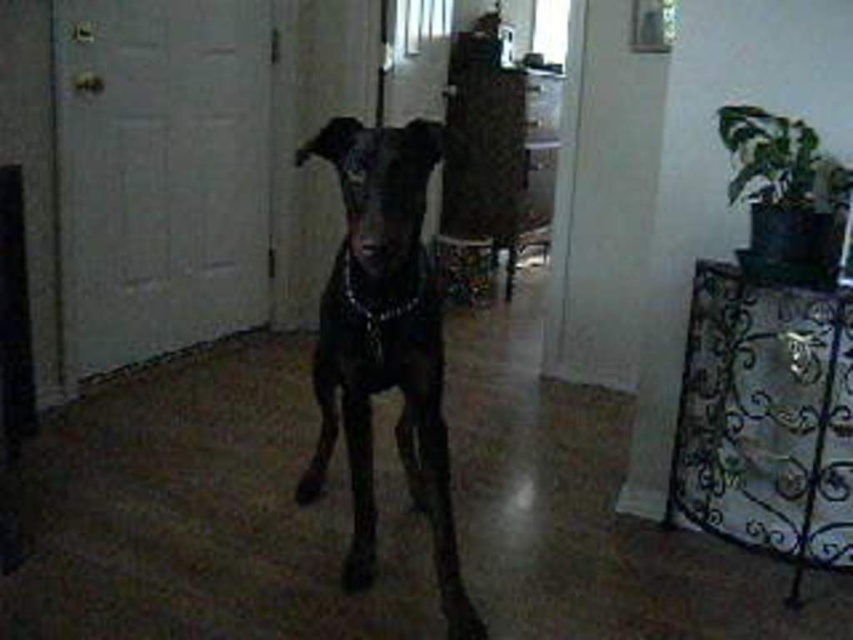
You are a dog trainer holding a leash that is 20 centimeters long. You want to attach the leash to the black chain at center so that the shiny black dog at center can move freely without pulling the leash tight. Is this possible?

The shiny black dog at center and the black chain at center are 20.34 centimeters apart from each other. Since the leash is only 20 centimeters long, the dog cannot move freely without pulling the leash tight because the distance between them exceeds the leash length.

Consider the image. You are a photographer trying to capture the shiny black dog at center and the black chain at center in a single frame. Given that the camera can only focus on one subject at a time, which subject should you choose to ensure the larger object is in focus?

The shiny black dog at center is larger in size than the black chain at center, so you should focus on the shiny black dog at center to ensure the larger object is in focus.

You are standing in the room and see the point marked at coordinates (384, 344). What object is located at that point?

The shiny black dog at center is located at point (384, 344).